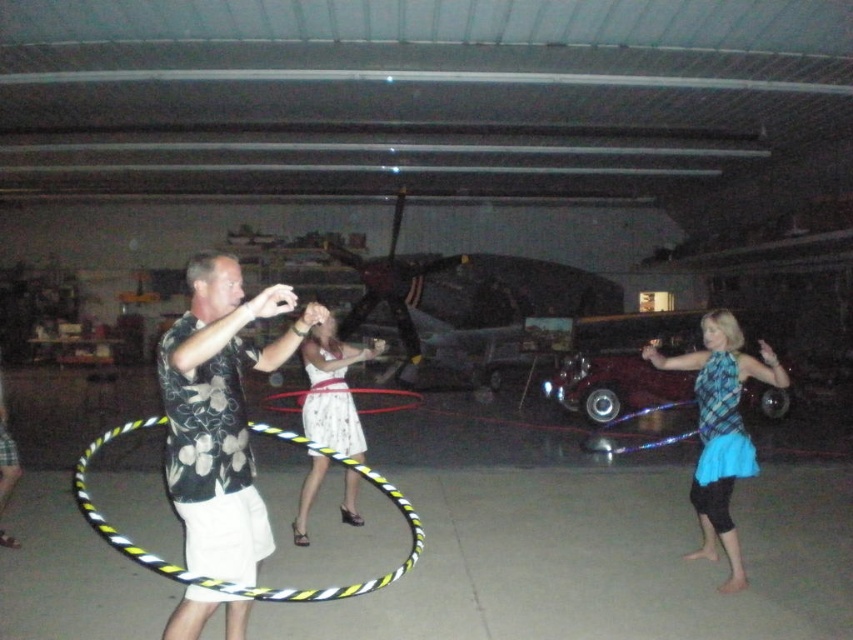
Image resolution: width=853 pixels, height=640 pixels. Describe the element at coordinates (219, 413) in the screenshot. I see `black floral shirt at center` at that location.

Can you confirm if black floral shirt at center is shorter than white floral dress at center?

No.

Between point (193, 406) and point (306, 493), which one is positioned behind?

The point (306, 493) is more distant.

Image resolution: width=853 pixels, height=640 pixels. Identify the location of black floral shirt at center. (219, 413).

From the picture: Is black floral shirt at center wider than blue plaid shirt at center?

No, black floral shirt at center is not wider than blue plaid shirt at center.

Who is taller, black floral shirt at center or blue plaid shirt at center?

Standing taller between the two is blue plaid shirt at center.

Is point (173, 410) farther from camera compared to point (762, 349)?

No.

Image resolution: width=853 pixels, height=640 pixels. Find the location of `black floral shirt at center`. black floral shirt at center is located at coordinates (219, 413).

Which is more to the right, black floral shirt at center or shiny maroon car at center?

From the viewer's perspective, shiny maroon car at center appears more on the right side.

Can you confirm if black floral shirt at center is smaller than shiny maroon car at center?

Correct, black floral shirt at center occupies less space than shiny maroon car at center.

Between point (247, 442) and point (624, 410), which one is positioned in front?

Positioned in front is point (247, 442).

Find the location of `black floral shirt at center`. black floral shirt at center is located at coordinates (219, 413).